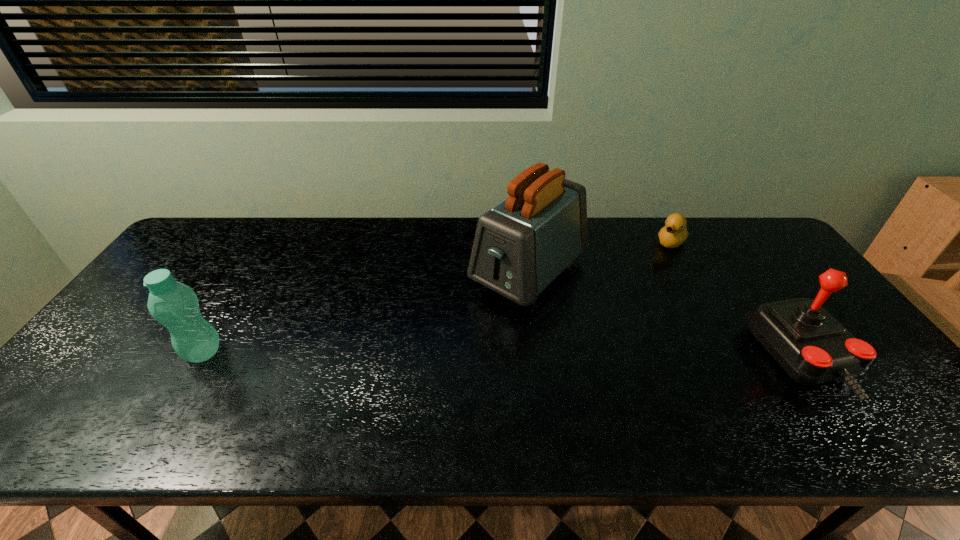
What are the coordinates of `vacant region located 0.390m facing forward on the duckling` in the screenshot? It's located at (611, 317).

I want to click on vacant area situated on the front-facing side of the tallest object, so click(429, 364).

Image resolution: width=960 pixels, height=540 pixels. In order to click on vacant area situated on the front-facing side of the tallest object in this screenshot , I will do `click(435, 360)`.

This screenshot has width=960, height=540. Find the location of `vacant space situated on the front-facing side of the tallest object`. vacant space situated on the front-facing side of the tallest object is located at coordinates (445, 349).

Locate an element on the screen. Image resolution: width=960 pixels, height=540 pixels. duckling that is positioned at the far edge is located at coordinates (674, 233).

You are a GUI agent. You are given a task and a screenshot of the screen. Output one action in this format:
    pyautogui.click(x=<x>, y=<y>)
    Task: Click on the toaster that is at the far edge
    Image resolution: width=960 pixels, height=540 pixels.
    Given the screenshot: What is the action you would take?
    pyautogui.click(x=521, y=245)

Locate an element on the screen. This screenshot has height=540, width=960. object that is at the near edge is located at coordinates (812, 347).

What are the coordinates of `object positioned at the right edge` in the screenshot? It's located at 812,347.

The width and height of the screenshot is (960, 540). In order to click on object located in the near right corner section of the desktop in this screenshot , I will do `click(812, 347)`.

Locate an element on the screen. The height and width of the screenshot is (540, 960). blank area at the far edge is located at coordinates (652, 256).